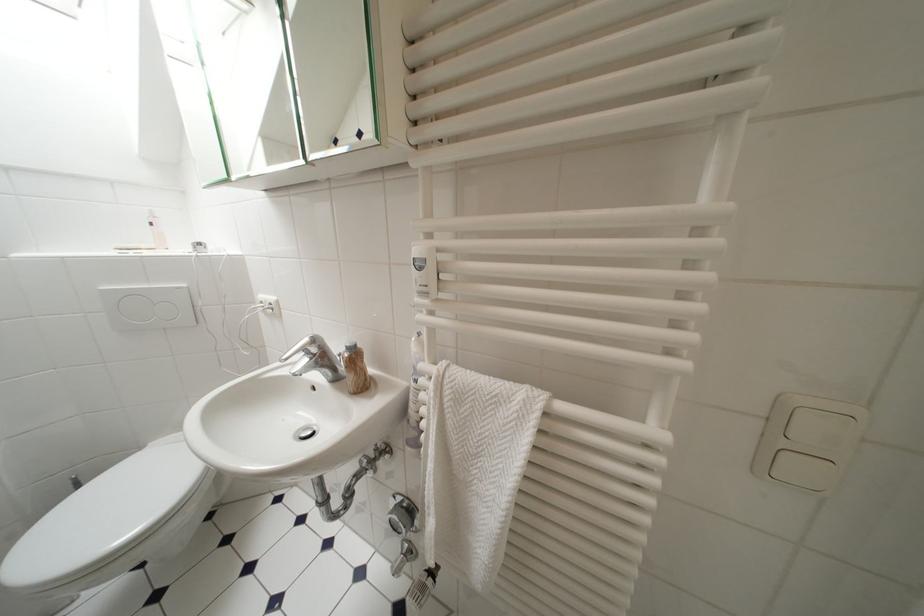
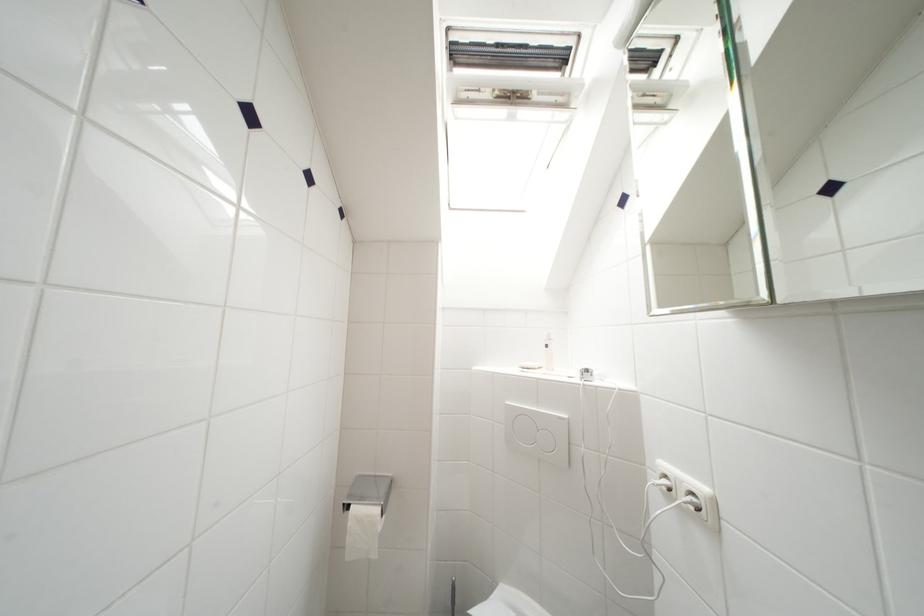
Where in the second image is the point corresponding to (185,291) from the first image?

(565, 421)